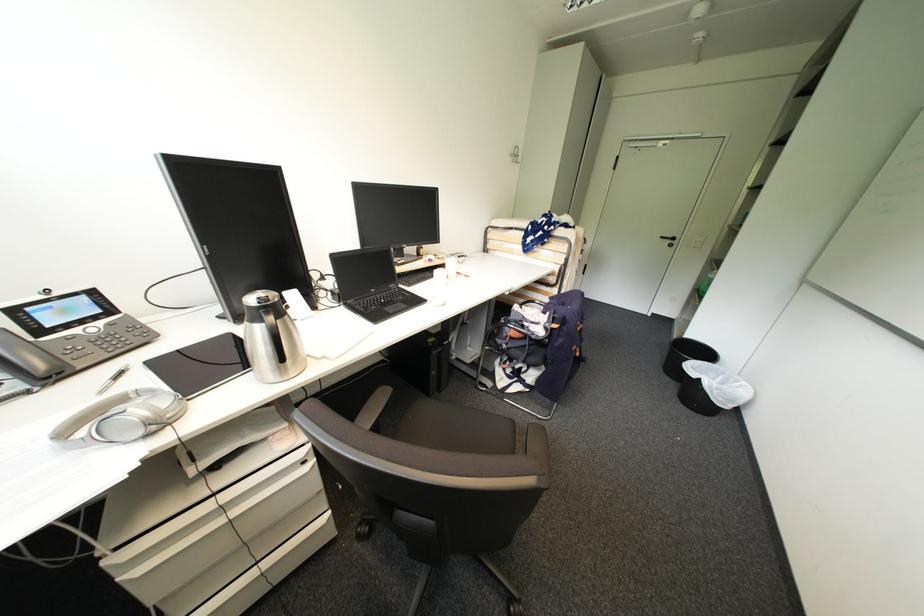
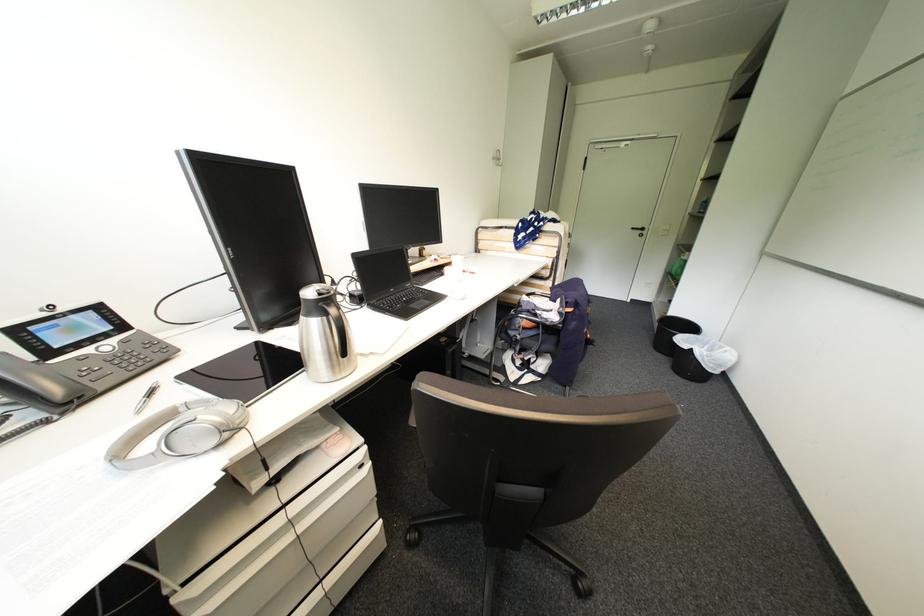
Locate, in the second image, the point that corresponds to the point at 224,467 in the first image.

(283, 480)